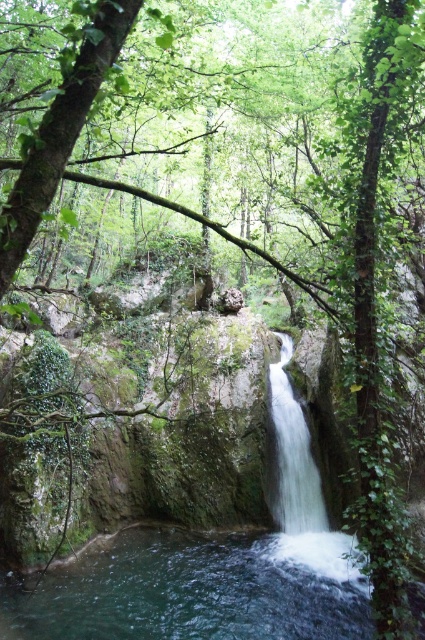
Can you confirm if clear water at center is positioned to the left of white smooth waterfall at center?

Yes, clear water at center is to the left of white smooth waterfall at center.

Does point (339, 596) come farther from viewer compared to point (286, 444)?

No, (339, 596) is closer to viewer.

Where is `clear water at center`? clear water at center is located at coordinates (195, 589).